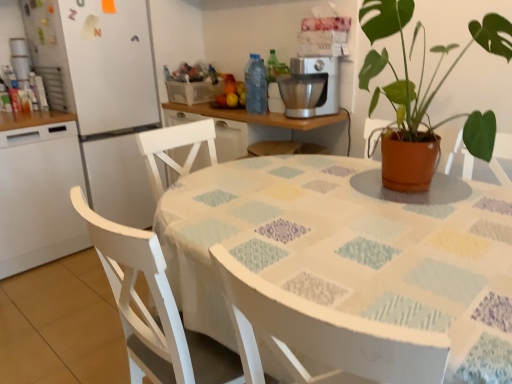
This screenshot has height=384, width=512. Identify the location of free region under terracotta pot at upper right (from a real-world perspective). (431, 181).